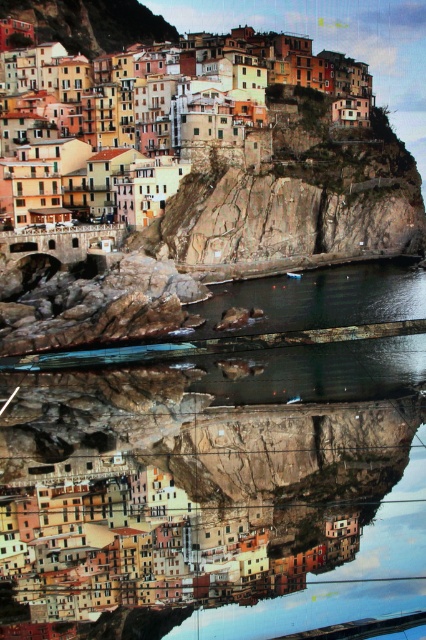
You are standing at the cliffside overlooking the coastal town. You notice two points marked in the image. Which point, point [270,508] or point [325,90], is closer to you?

Point [270,508] is closer to the viewer than point [325,90].

You are a tourist standing at the entrance of the coastal town and want to take a photo of the transparent glass water at center. Which direction should you face to capture it in your viewfinder?

The transparent glass water at center is located at point coordinates of 0.736 on the x axis and 0.580 on the y axis, so you should face towards the center of the image to capture it in your viewfinder.

You are standing at the cliffside overlooking the coastal town. You notice a point marked at coordinates [247,470]. Based on the scene description, what is the most likely feature at that location?

The point at [247,470] corresponds to transparent glass water at center, as stated in the Objects Description.